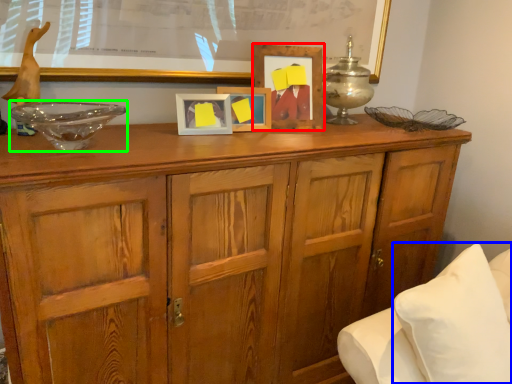
Question: Which is farther away from picture frame (highlighted by a red box)? pillow (highlighted by a blue box) or glass bowl (highlighted by a green box)?

Choices:
 (A) pillow
 (B) glass bowl

Answer: (A)